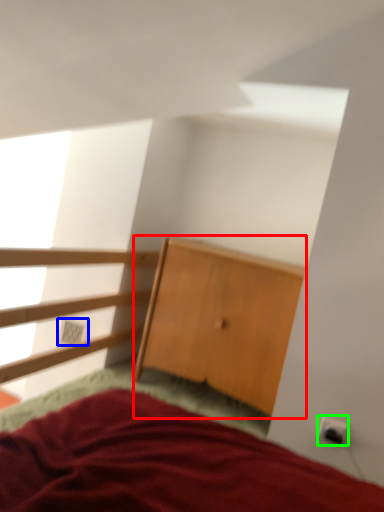
Question: Which object is the closest to the dresser (highlighted by a red box)? Choose among these: electric outlet (highlighted by a blue box) or electric outlet (highlighted by a green box).

Choices:
 (A) electric outlet
 (B) electric outlet

Answer: (B)